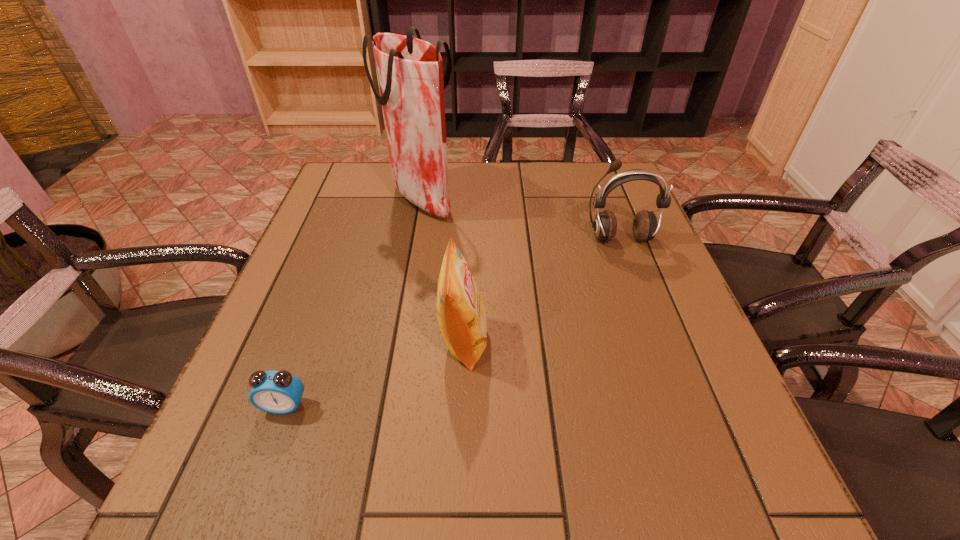
What are the coordinates of `blank space that satisfies the following two spatial constraints: 1. on the ear pads of the rightmost object; 2. on the front-facing side of the crisp (potato chip)` in the screenshot? It's located at (657, 341).

This screenshot has height=540, width=960. I want to click on free space that satisfies the following two spatial constraints: 1. on the ear pads of the earphone; 2. on the front-facing side of the crisp (potato chip), so click(657, 341).

Where is `free space that satisfies the following two spatial constraints: 1. on the front-facing side of the crisp (potato chip); 2. on the face of the leftmost object`? This screenshot has width=960, height=540. free space that satisfies the following two spatial constraints: 1. on the front-facing side of the crisp (potato chip); 2. on the face of the leftmost object is located at coordinates (462, 406).

The image size is (960, 540). I want to click on blank area in the image that satisfies the following two spatial constraints: 1. on the ear pads of the third nearest object; 2. on the front-facing side of the crisp (potato chip), so click(x=657, y=341).

The image size is (960, 540). Find the location of `free space that satisfies the following two spatial constraints: 1. on the front-facing side of the third farthest object; 2. on the face of the leftmost object`. free space that satisfies the following two spatial constraints: 1. on the front-facing side of the third farthest object; 2. on the face of the leftmost object is located at coordinates (462, 406).